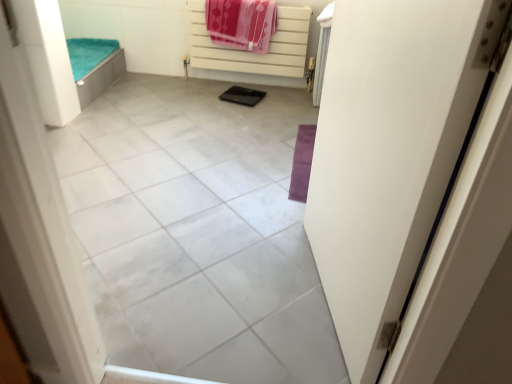
This screenshot has height=384, width=512. What are the coordinates of `vacant area that is in front of white matte radiator at upper center` in the screenshot? It's located at (230, 125).